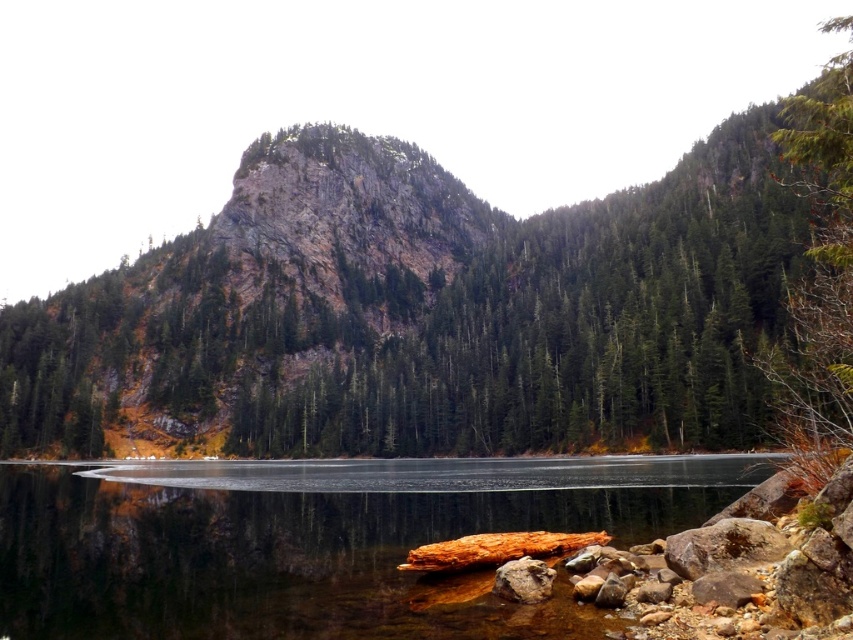
Is point (836, 392) positioned before point (509, 577)?

No.

Find the location of a particular element. green textured tree at right is located at coordinates (819, 257).

Who is shorter, smooth rock water at center or rusty metallic rock at lower center?

Standing shorter between the two is rusty metallic rock at lower center.

Is smooth rock water at center thinner than rusty metallic rock at lower center?

In fact, smooth rock water at center might be wider than rusty metallic rock at lower center.

At what (x,y) coordinates should I click in order to perform the action: click on smooth rock water at center. Please return your answer as a coordinate pair (x, y). The image size is (853, 640). Looking at the image, I should click on (317, 541).

Is smooth rock water at center below green textured tree at right?

Yes, smooth rock water at center is below green textured tree at right.

I want to click on smooth rock water at center, so click(x=317, y=541).